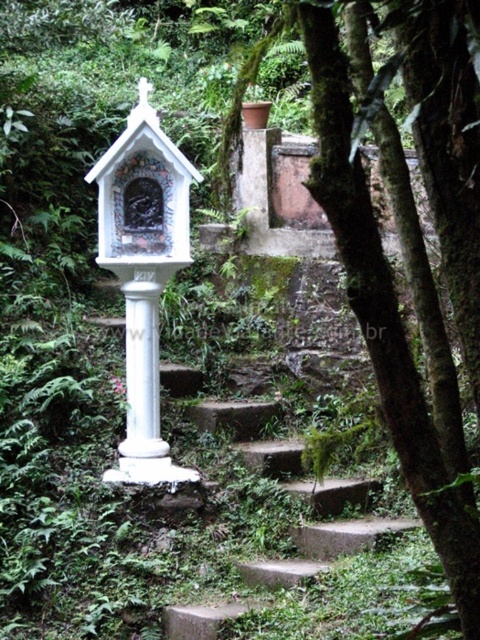
Question: Among these points, which one is farthest from the camera?

Choices:
 (A) (339, 134)
 (B) (134, 483)

Answer: (B)

Question: Does green mossy bark tree at center have a larger size compared to white painted wood bird feeder at center?

Choices:
 (A) no
 (B) yes

Answer: (A)

Question: Which object is closer to the camera taking this photo?

Choices:
 (A) green mossy bark tree at center
 (B) white painted wood bird feeder at center

Answer: (A)

Question: Among these objects, which one is farthest from the camera?

Choices:
 (A) green mossy bark tree at center
 (B) white painted wood bird feeder at center

Answer: (B)

Question: Is green mossy bark tree at center above white painted wood bird feeder at center?

Choices:
 (A) no
 (B) yes

Answer: (A)

Question: Can you confirm if green mossy bark tree at center is thinner than white painted wood bird feeder at center?

Choices:
 (A) yes
 (B) no

Answer: (A)